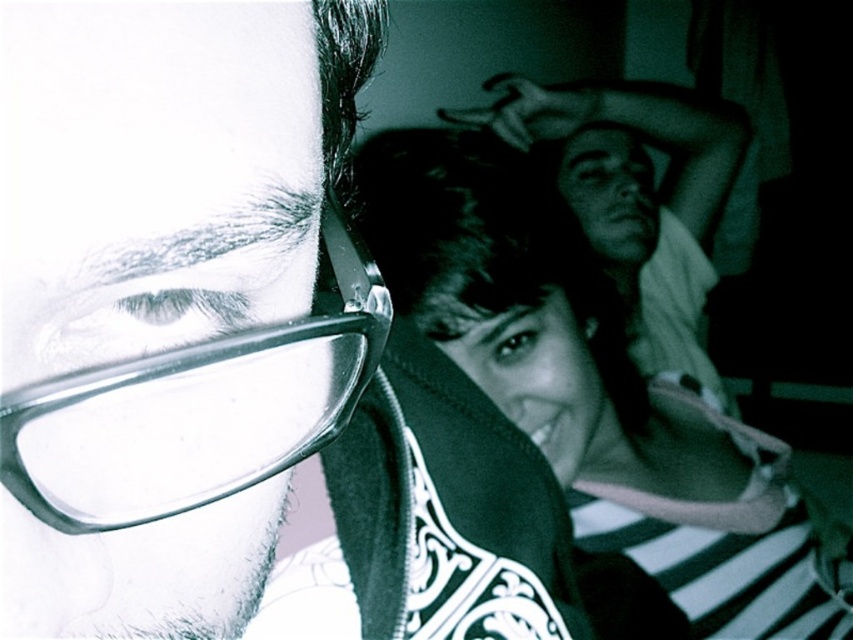
Question: Estimate the real-world distances between objects in this image. Which object is closer to the clear plastic glasses at center?

Choices:
 (A) smooth white shirt at upper right
 (B) matte black glasses at upper left

Answer: (B)

Question: Is matte black glasses at upper left to the right of smooth white shirt at upper right from the viewer's perspective?

Choices:
 (A) yes
 (B) no

Answer: (B)

Question: Is matte black glasses at upper left above smooth white shirt at upper right?

Choices:
 (A) no
 (B) yes

Answer: (A)

Question: Which object is positioned farthest from the clear plastic glasses at center?

Choices:
 (A) matte black glasses at upper left
 (B) smooth white shirt at upper right

Answer: (B)

Question: Which point appears farthest from the camera in this image?

Choices:
 (A) (704, 264)
 (B) (260, 428)

Answer: (A)

Question: Does matte black glasses at upper left have a greater width compared to matte black hoodie at center?

Choices:
 (A) no
 (B) yes

Answer: (A)